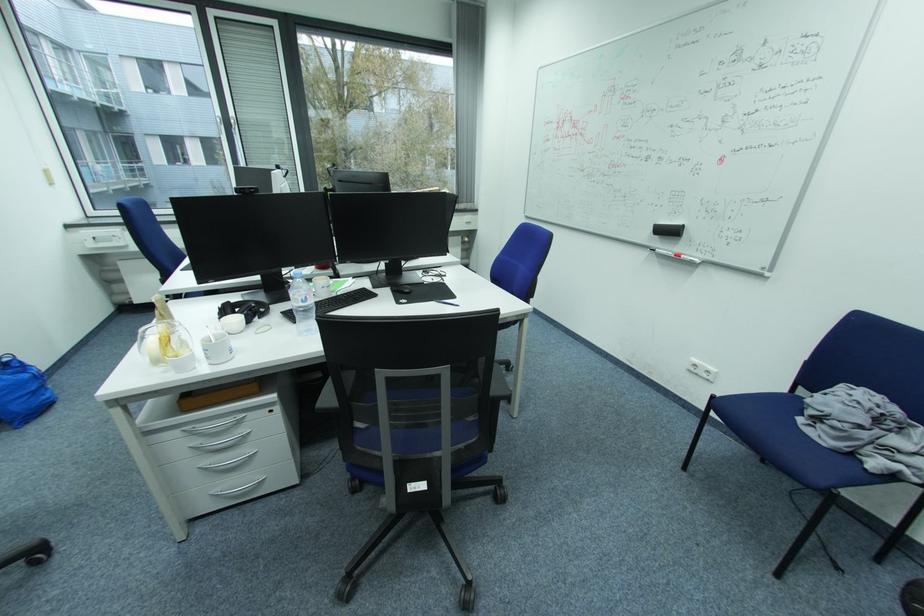
Locate an element on the screen. white cup handle is located at coordinates (215, 346).